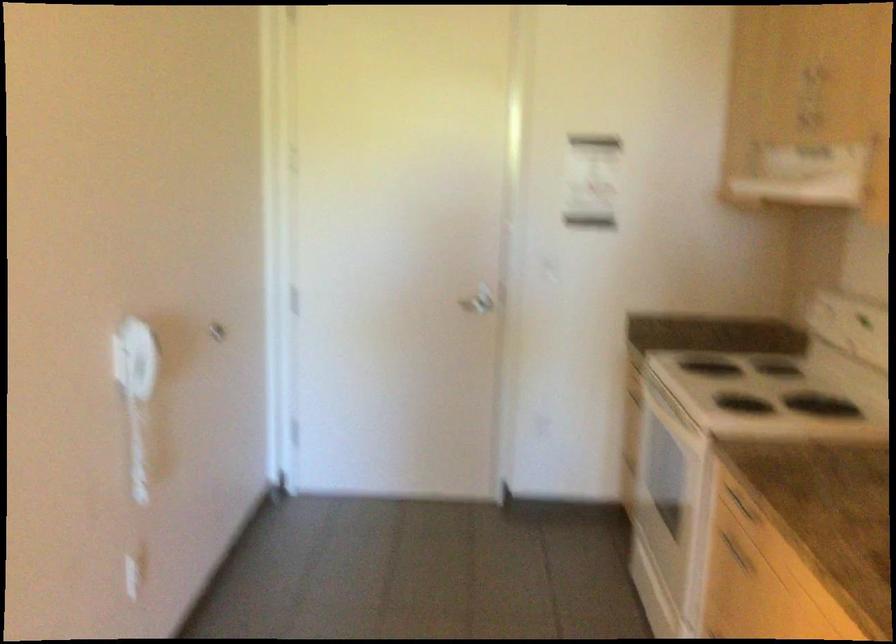
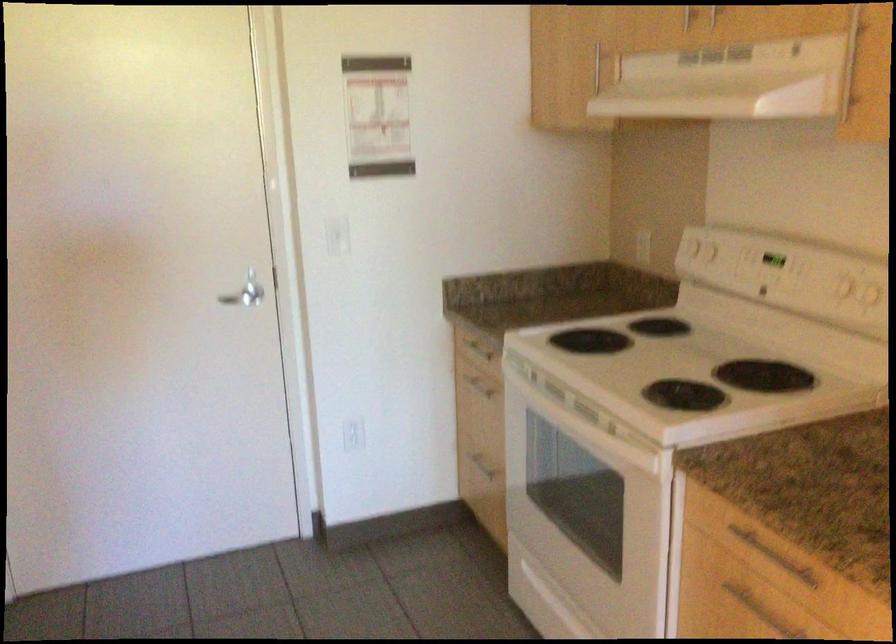
The point at [536,422] is marked in the first image. Where is the corresponding point in the second image?

(352, 433)